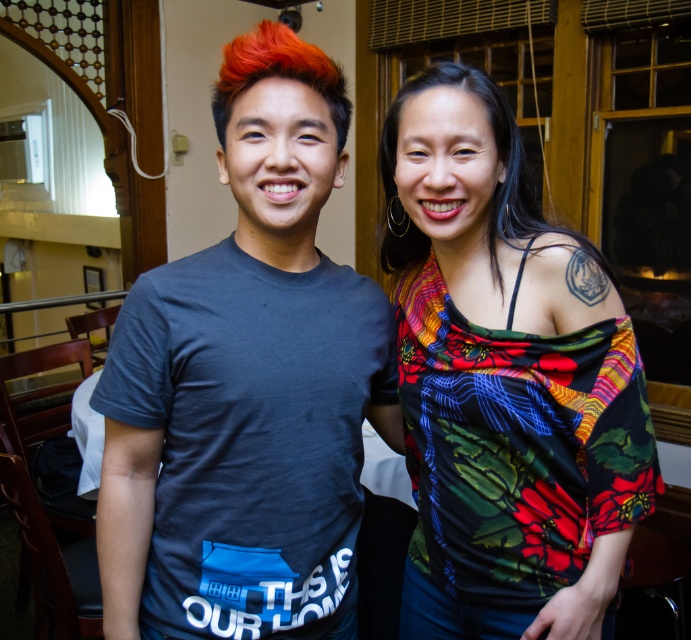
You are standing in a room with two people. There is a point at coordinates (498, 157). What object is located at that point?

The point at coordinates (498, 157) indicates black silky hair at upper right.

You are a photographer setting up for a group photo. You need to position the black silky hair at upper right and the bright orange hair at center so that they are aligned horizontally. Based on their current positions, which direction should you move one of them to achieve this alignment?

The black silky hair at upper right is currently located below the bright orange hair at center. To align them horizontally, you should move the black silky hair at upper right upwards or move the bright orange hair at center downwards.

What is the location of the floral print top at center in the image?

The floral print top at center is located at point (504,380).